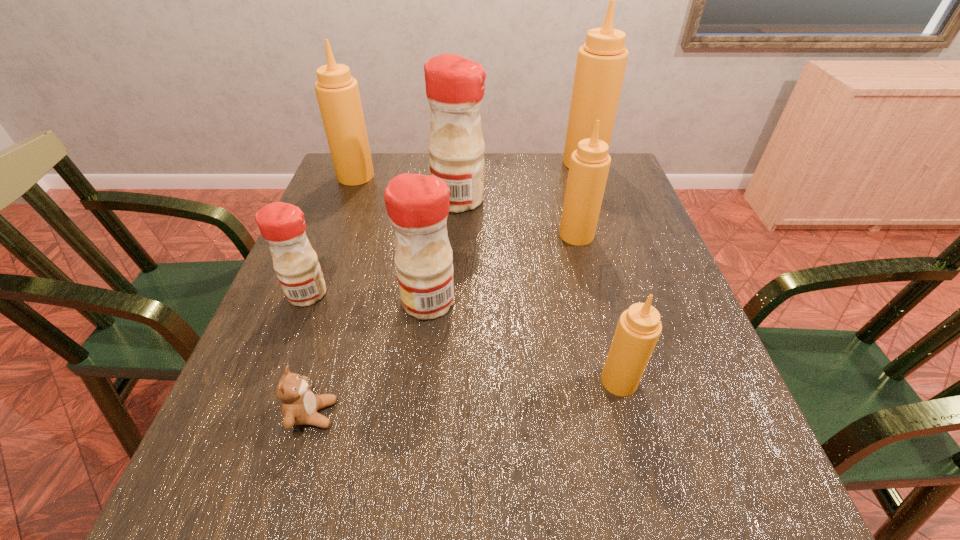
The width and height of the screenshot is (960, 540). What are the coordinates of `red condiment that can be found as the third closest to the biggest tan condiment` in the screenshot? It's located at (282, 225).

At what (x,y) coordinates should I click in order to perform the action: click on the second closest red condiment to the smallest red condiment. Please return your answer as a coordinate pair (x, y). Image resolution: width=960 pixels, height=540 pixels. Looking at the image, I should click on coord(455,86).